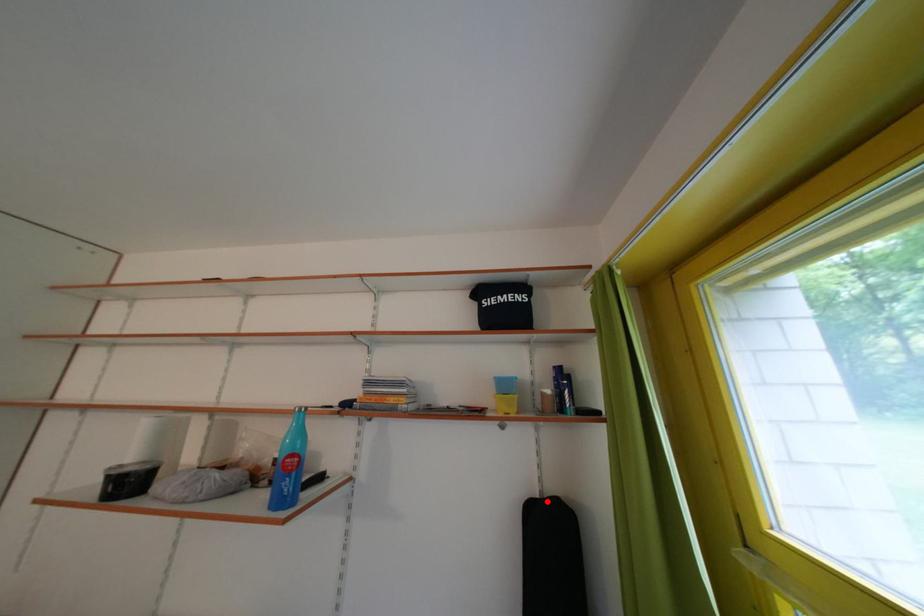
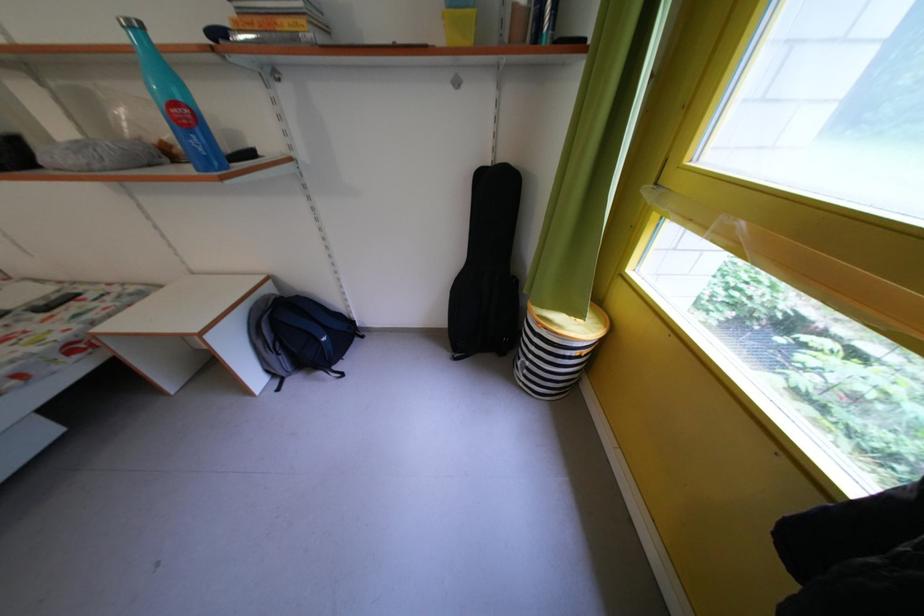
In the second image, find the point that corresponds to the highlighted location in the first image.

(499, 171)